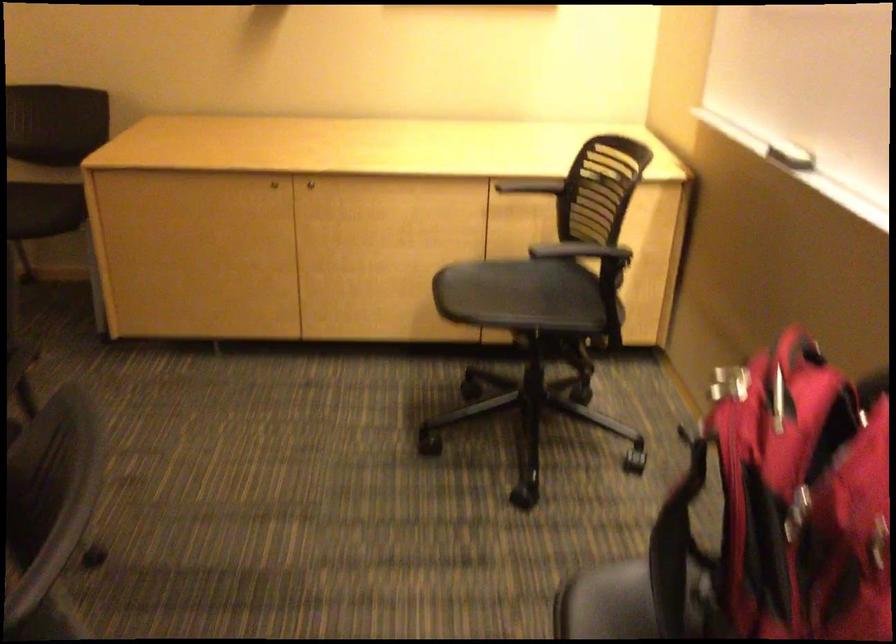
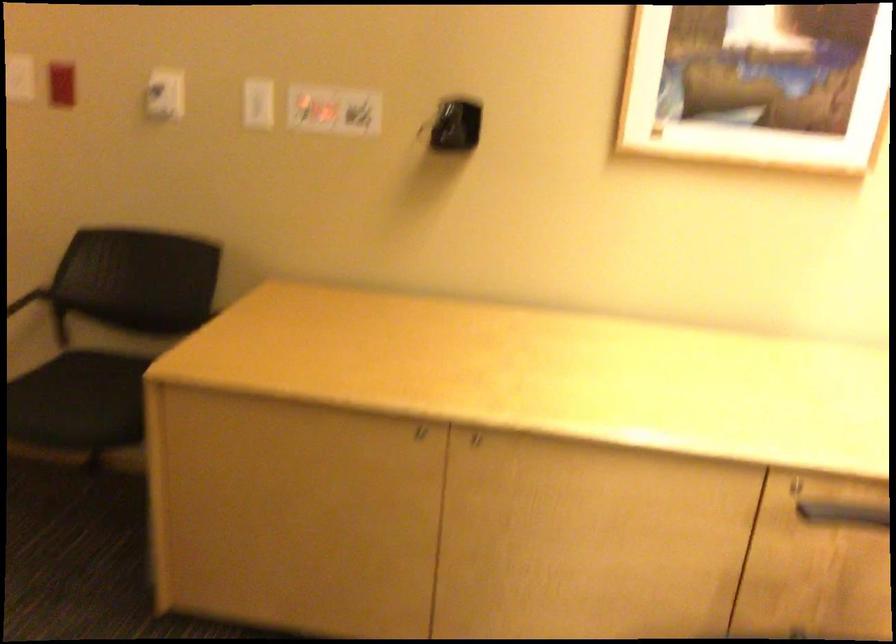
Find the pixel in the second image that matches (521,202) in the first image.

(828, 507)